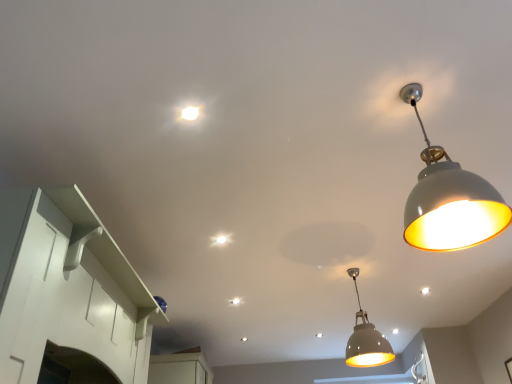
The image size is (512, 384). I want to click on matte white pendant light at center, the first lamp in the bottom-to-top sequence, so click(x=366, y=340).

The width and height of the screenshot is (512, 384). What do you see at coordinates (366, 340) in the screenshot?
I see `matte white pendant light at center, the 2th lamp from the top` at bounding box center [366, 340].

Image resolution: width=512 pixels, height=384 pixels. Describe the element at coordinates (449, 200) in the screenshot. I see `white glossy pendant light at upper right, which is counted as the first lamp, starting from the top` at that location.

Find the location of a particular element. The image size is (512, 384). white glossy pendant light at upper right, which is counted as the first lamp, starting from the top is located at coordinates (449, 200).

At what (x,y) coordinates should I click in order to perform the action: click on white glossy cabinet at left. Please return your answer as a coordinate pair (x, y). This screenshot has height=384, width=512. Looking at the image, I should click on (68, 294).

What's the angular difference between white glossy cabinet at left and white glossy pendant light at upper right, which is counted as the first lamp, starting from the top,'s facing directions?

87.7 degrees separate the facing orientations of white glossy cabinet at left and white glossy pendant light at upper right, which is counted as the first lamp, starting from the top.

Between white glossy cabinet at left and white glossy pendant light at upper right, which is the second lamp from back to front, which one appears on the left side from the viewer's perspective?

white glossy cabinet at left.

Considering the relative sizes of white glossy cabinet at left and white glossy pendant light at upper right, which is the first lamp in front-to-back order, in the image provided, is white glossy cabinet at left wider than white glossy pendant light at upper right, which is the first lamp in front-to-back order,?

Incorrect, the width of white glossy cabinet at left does not surpass that of white glossy pendant light at upper right, which is the first lamp in front-to-back order.

Is white glossy cabinet at left taller than white glossy pendant light at upper right, which is the first lamp in front-to-back order?

No, white glossy cabinet at left is not taller than white glossy pendant light at upper right, which is the first lamp in front-to-back order.

Would you say white glossy pendant light at upper right, which is the first lamp in front-to-back order, is to the left or to the right of matte white pendant light at center, the 2th lamp from the top, in the picture?

white glossy pendant light at upper right, which is the first lamp in front-to-back order, is positioned on matte white pendant light at center, the 2th lamp from the top,'s left side.

Could you tell me if white glossy pendant light at upper right, which is counted as the first lamp, starting from the top, is turned towards matte white pendant light at center, the 2th lamp from the top?

No, white glossy pendant light at upper right, which is counted as the first lamp, starting from the top, is not aimed at matte white pendant light at center, the 2th lamp from the top.

Are white glossy pendant light at upper right, which is the second lamp from back to front, and matte white pendant light at center, the 2th lamp from the top, located far from each other?

white glossy pendant light at upper right, which is the second lamp from back to front, is positioned a significant distance from matte white pendant light at center, the 2th lamp from the top.

Consider the image. From the image's perspective, is matte white pendant light at center, the 2th lamp from the top, above white glossy light bulb at upper center?

No.

Considering the relative sizes of matte white pendant light at center, the first lamp in the bottom-to-top sequence, and white glossy light bulb at upper center in the image provided, is matte white pendant light at center, the first lamp in the bottom-to-top sequence, thinner than white glossy light bulb at upper center?

Incorrect, the width of matte white pendant light at center, the first lamp in the bottom-to-top sequence, is not less than that of white glossy light bulb at upper center.

Is matte white pendant light at center, the first lamp positioned from the back, with white glossy light bulb at upper center?

No, matte white pendant light at center, the first lamp positioned from the back, is not touching white glossy light bulb at upper center.

Is matte white pendant light at center, the first lamp positioned from the back, facing towards white glossy light bulb at upper center?

No, matte white pendant light at center, the first lamp positioned from the back, is not turned towards white glossy light bulb at upper center.

From a real-world perspective, between white glossy light bulb at upper center and white glossy cabinet at left, who is vertically higher?

In real-world perspective, white glossy light bulb at upper center is above.

Can we say white glossy light bulb at upper center lies outside white glossy cabinet at left?

Yes, white glossy light bulb at upper center is outside of white glossy cabinet at left.

Does point (191, 111) come in front of point (77, 351)?

Yes.

Which of these two, white glossy cabinet at left or matte white pendant light at center, the first lamp positioned from the back, is bigger?

matte white pendant light at center, the first lamp positioned from the back.

Can you confirm if white glossy cabinet at left is thinner than matte white pendant light at center, the first lamp in the bottom-to-top sequence?

Yes.

From the image's perspective, is white glossy cabinet at left under matte white pendant light at center, the second lamp from the front?

No, from the image's perspective, white glossy cabinet at left is not beneath matte white pendant light at center, the second lamp from the front.

Consider the image. Is white glossy cabinet at left not close to matte white pendant light at center, the second lamp from the front?

Yes, white glossy cabinet at left is far from matte white pendant light at center, the second lamp from the front.

Considering the relative sizes of white glossy light bulb at upper center and matte white pendant light at center, the 2th lamp from the top, in the image provided, is white glossy light bulb at upper center thinner than matte white pendant light at center, the 2th lamp from the top,?

Yes.

Consider the image. Considering the sizes of objects white glossy light bulb at upper center and matte white pendant light at center, the second lamp from the front, in the image provided, who is taller, white glossy light bulb at upper center or matte white pendant light at center, the second lamp from the front,?

With more height is matte white pendant light at center, the second lamp from the front.

Is white glossy light bulb at upper center oriented towards matte white pendant light at center, the first lamp in the bottom-to-top sequence?

No, white glossy light bulb at upper center is not oriented towards matte white pendant light at center, the first lamp in the bottom-to-top sequence.

Measure the distance from white glossy light bulb at upper center to matte white pendant light at center, the first lamp positioned from the back.

white glossy light bulb at upper center and matte white pendant light at center, the first lamp positioned from the back, are 1.96 meters apart.

Between white glossy light bulb at upper center and white glossy pendant light at upper right, which is counted as the first lamp, starting from the top, which one has smaller size?

With smaller size is white glossy light bulb at upper center.

Is white glossy pendant light at upper right, which is counted as the first lamp, starting from the top, a part of white glossy light bulb at upper center?

Actually, white glossy pendant light at upper right, which is counted as the first lamp, starting from the top, is outside white glossy light bulb at upper center.

Are white glossy light bulb at upper center and white glossy pendant light at upper right, the second lamp from the bottom, beside each other?

white glossy light bulb at upper center and white glossy pendant light at upper right, the second lamp from the bottom, are not in contact.

This screenshot has height=384, width=512. Identify the location of light bulb behind the white glossy pendant light at upper right, the second lamp from the bottom. (190, 113).

You are a GUI agent. You are given a task and a screenshot of the screen. Output one action in this format:
    pyautogui.click(x=<x>, y=<y>)
    Task: Click on the lamp located in front of the white glossy cabinet at left
    The image size is (512, 384).
    Given the screenshot: What is the action you would take?
    pyautogui.click(x=449, y=200)

Locate an element on the screen. This screenshot has height=384, width=512. lamp located underneath the matte white pendant light at center, the first lamp positioned from the back (from a real-world perspective) is located at coordinates (449, 200).

Estimate the real-world distances between objects in this image. Which object is further from white glossy cabinet at left, matte white pendant light at center, the 2th lamp from the top, or white glossy light bulb at upper center?

matte white pendant light at center, the 2th lamp from the top.

Which object lies further to the anchor point white glossy light bulb at upper center, matte white pendant light at center, the first lamp positioned from the back, or white glossy pendant light at upper right, which is the first lamp in front-to-back order?

matte white pendant light at center, the first lamp positioned from the back, lies further to white glossy light bulb at upper center than the other object.

Based on their spatial positions, is matte white pendant light at center, the second lamp from the front, or white glossy cabinet at left closer to white glossy light bulb at upper center?

The object closer to white glossy light bulb at upper center is white glossy cabinet at left.

Considering their positions, is white glossy cabinet at left positioned further to white glossy pendant light at upper right, the second lamp from the bottom, than matte white pendant light at center, the first lamp positioned from the back?

Among the two, white glossy cabinet at left is located further to white glossy pendant light at upper right, the second lamp from the bottom.

Looking at the image, which one is located further to white glossy light bulb at upper center, white glossy pendant light at upper right, the second lamp from the bottom, or matte white pendant light at center, the first lamp in the bottom-to-top sequence?

Based on the image, matte white pendant light at center, the first lamp in the bottom-to-top sequence, appears to be further to white glossy light bulb at upper center.

From the picture: From the image, which object appears to be nearer to matte white pendant light at center, the first lamp in the bottom-to-top sequence, white glossy light bulb at upper center or white glossy pendant light at upper right, which is the second lamp from back to front?

white glossy pendant light at upper right, which is the second lamp from back to front, lies closer to matte white pendant light at center, the first lamp in the bottom-to-top sequence, than the other object.

Looking at the image, which one is located further to white glossy cabinet at left, white glossy light bulb at upper center or white glossy pendant light at upper right, which is counted as the first lamp, starting from the top?

white glossy pendant light at upper right, which is counted as the first lamp, starting from the top, is further to white glossy cabinet at left.

Which object lies nearer to the anchor point white glossy pendant light at upper right, which is the second lamp from back to front, white glossy light bulb at upper center or white glossy cabinet at left?

The object closer to white glossy pendant light at upper right, which is the second lamp from back to front, is white glossy light bulb at upper center.

At what (x,y) coordinates should I click in order to perform the action: click on light bulb positioned between white glossy pendant light at upper right, which is counted as the first lamp, starting from the top, and matte white pendant light at center, the 2th lamp from the top, from near to far. Please return your answer as a coordinate pair (x, y). Looking at the image, I should click on (190, 113).

Locate an element on the screen. Image resolution: width=512 pixels, height=384 pixels. lamp between white glossy cabinet at left and matte white pendant light at center, the first lamp in the bottom-to-top sequence, from left to right is located at coordinates (449, 200).

Where is `light bulb situated between white glossy cabinet at left and white glossy pendant light at upper right, which is the first lamp in front-to-back order, from left to right`? light bulb situated between white glossy cabinet at left and white glossy pendant light at upper right, which is the first lamp in front-to-back order, from left to right is located at coordinates (190, 113).

At what (x,y) coordinates should I click in order to perform the action: click on light bulb situated between white glossy cabinet at left and matte white pendant light at center, the 2th lamp from the top, from left to right. Please return your answer as a coordinate pair (x, y). This screenshot has height=384, width=512. Looking at the image, I should click on (190, 113).